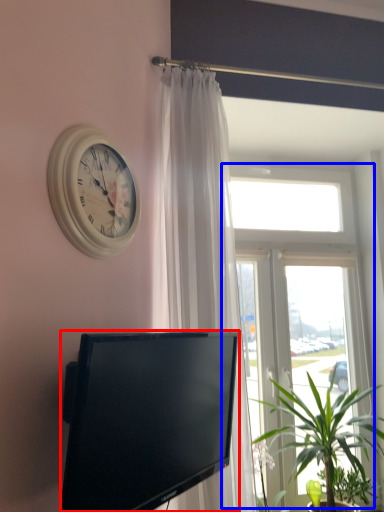
Question: Which of the following is the closest to the observer, television (highlighted by a red box) or window (highlighted by a blue box)?

Choices:
 (A) television
 (B) window

Answer: (A)